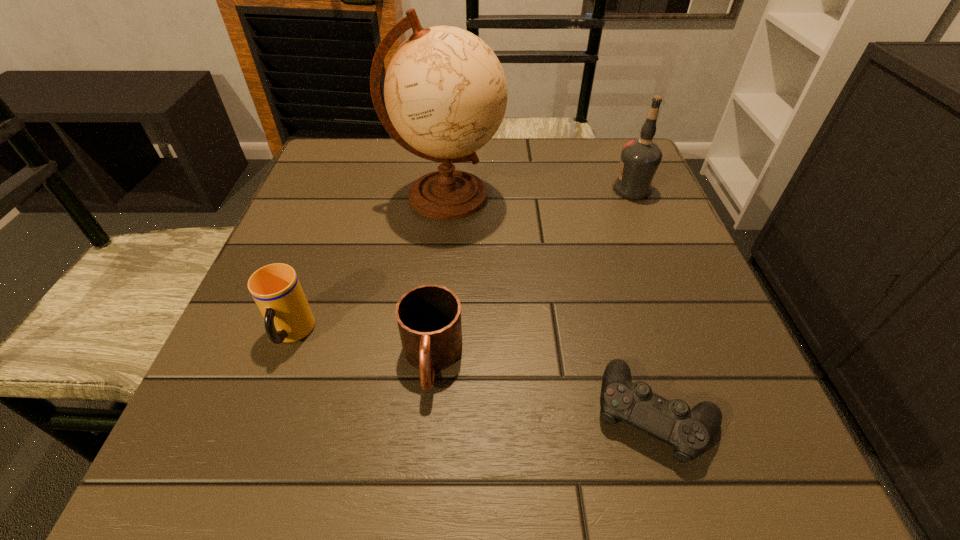
Locate an element on the screen. vacant space at the far edge is located at coordinates (532, 186).

In the image, there is a desktop. Where is `vacant area at the near edge`? The width and height of the screenshot is (960, 540). vacant area at the near edge is located at coordinates pyautogui.click(x=474, y=482).

At what (x,y) coordinates should I click in order to perform the action: click on vacant space at the right edge of the desktop. Please return your answer as a coordinate pair (x, y). Image resolution: width=960 pixels, height=540 pixels. Looking at the image, I should click on (611, 240).

This screenshot has width=960, height=540. In the image, there is a desktop. Identify the location of vacant space at the far left corner. (327, 161).

In the image, there is a desktop. In order to click on vacant space at the far right corner in this screenshot , I will do `click(600, 151)`.

Where is `vacant space at the near right corner of the desktop`? Image resolution: width=960 pixels, height=540 pixels. vacant space at the near right corner of the desktop is located at coordinates (711, 476).

You are a GUI agent. You are given a task and a screenshot of the screen. Output one action in this format:
    pyautogui.click(x=<x>, y=<y>)
    Task: Click on the free area in between the globe and the fourth tallest object
    This screenshot has height=540, width=960.
    Given the screenshot: What is the action you would take?
    pyautogui.click(x=439, y=278)

At what (x,y) coordinates should I click in order to perform the action: click on vacant space that is in between the third shortest object and the shortest object. Please return your answer as a coordinate pair (x, y). The width and height of the screenshot is (960, 540). Looking at the image, I should click on (473, 374).

Identify the location of vacant point located between the tallest object and the second tallest object. (539, 193).

At what (x,y) coordinates should I click in order to perform the action: click on free space between the fourth tallest object and the globe. Please return your answer as a coordinate pair (x, y). This screenshot has width=960, height=540. Looking at the image, I should click on (439, 278).